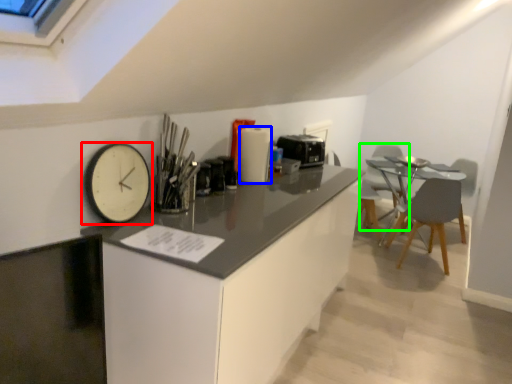
Question: Which object is positioned farthest from wall clock (highlighted by a red box)? Select from appliance (highlighted by a blue box) and swivel chair (highlighted by a green box).

Choices:
 (A) appliance
 (B) swivel chair

Answer: (B)